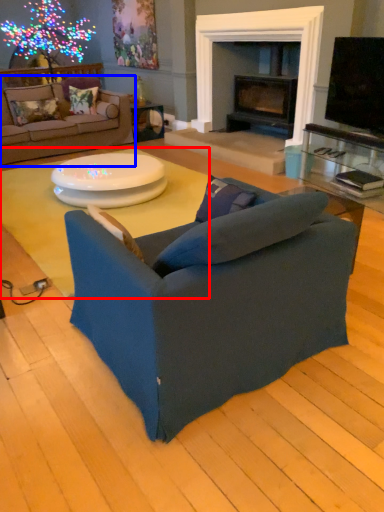
Question: Which object appears closest to the camera in this image, coffee table (highlighted by a red box) or studio couch (highlighted by a blue box)?

Choices:
 (A) coffee table
 (B) studio couch

Answer: (A)